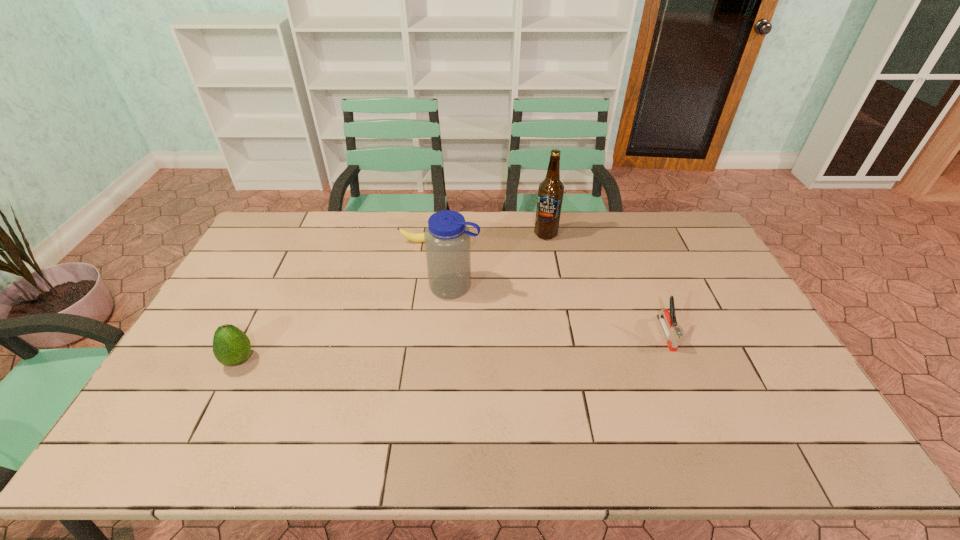
Where is `vacant region between the beer bottle and the third farthest object`? vacant region between the beer bottle and the third farthest object is located at coordinates point(500,260).

At what (x,y) coordinates should I click in order to perform the action: click on vacant area that lies between the banana and the beer bottle. Please return your answer as a coordinate pair (x, y). The image size is (960, 540). Looking at the image, I should click on (487, 238).

Locate an element on the screen. free space between the avocado and the tallest object is located at coordinates point(393,297).

Identify the location of vacant space in between the shortest object and the rightmost object. The height and width of the screenshot is (540, 960). (546, 287).

The height and width of the screenshot is (540, 960). What are the coordinates of `empty location between the second tallest object and the rightmost object` in the screenshot? It's located at (561, 310).

Locate an element on the screen. empty space that is in between the third tallest object and the water bottle is located at coordinates (348, 323).

This screenshot has width=960, height=540. Identify the location of free space between the fourth shortest object and the leftmost object. (348, 323).

Locate an element on the screen. This screenshot has height=540, width=960. vacant point located between the banana and the tallest object is located at coordinates (487, 238).

The width and height of the screenshot is (960, 540). I want to click on empty location between the water bottle and the second shortest object, so (561, 310).

Identify which object is the third nearest to the avocado. Please provide its 2D coordinates. Your answer should be formatted as a tuple, i.e. [(x, y)], where the tuple contains the x and y coordinates of a point satisfying the conditions above.

[(550, 192)]